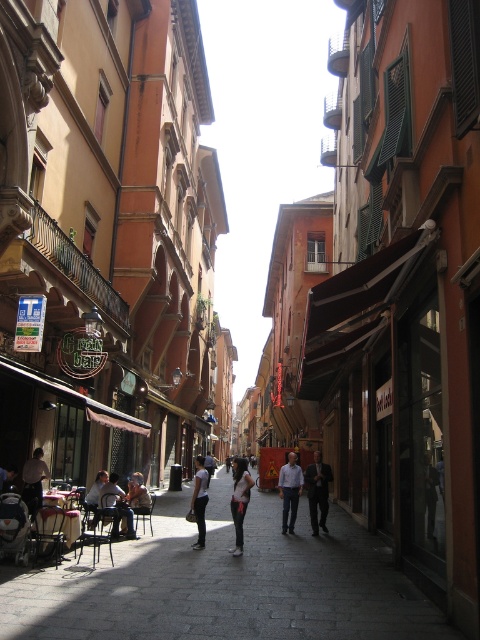
Question: Does white fabric bag at center lie in front of dark gray shirt at center?

Choices:
 (A) yes
 (B) no

Answer: (A)

Question: Which object is closer to the camera taking this photo?

Choices:
 (A) matte black stroller at lower left
 (B) dark gray suit at center
 (C) light blue shirt at center
 (D) light brown wooden chair at center

Answer: (A)

Question: Which point is closer to the camera?

Choices:
 (A) (131, 508)
 (B) (311, 496)
 (C) (204, 474)

Answer: (C)

Question: Is white fabric bag at center to the right of light brown leather jacket at center from the viewer's perspective?

Choices:
 (A) yes
 (B) no

Answer: (A)

Question: Which object appears closest to the camera in this image?

Choices:
 (A) light brown leather jacket at center
 (B) dark gray shirt at center

Answer: (B)

Question: Can you confirm if dark gray suit at center is bigger than dark gray shirt at center?

Choices:
 (A) yes
 (B) no

Answer: (A)